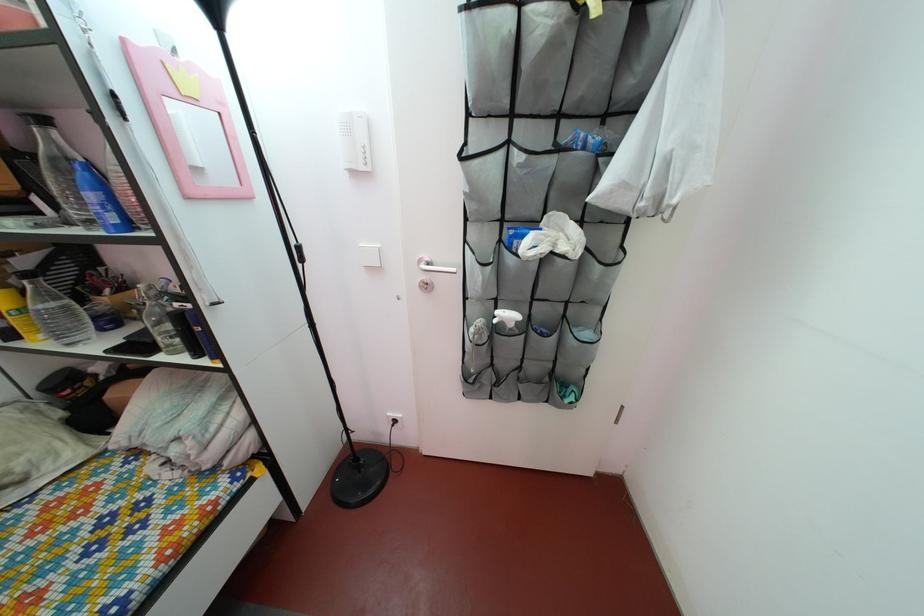
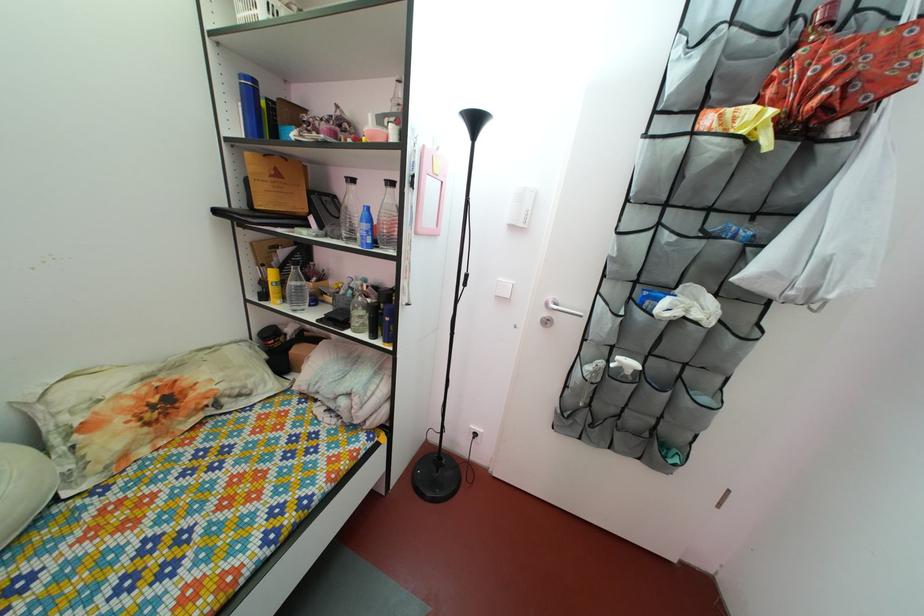
Question: How did the camera likely rotate?

Choices:
 (A) Left
 (B) Right
 (C) Up
 (D) Down

Answer: (A)